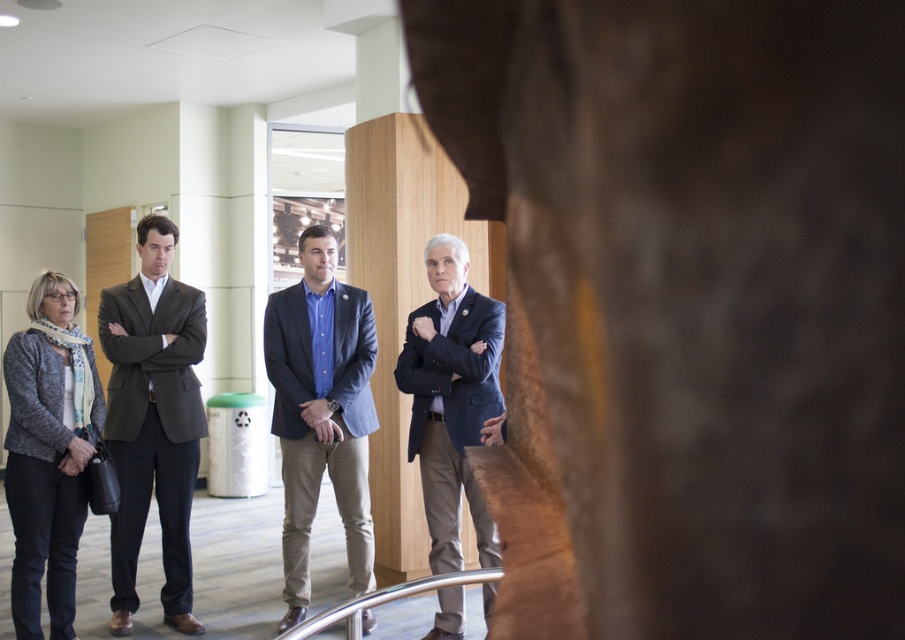
Question: Can you confirm if matte black suit at left is positioned below matte blue shirt at center?

Choices:
 (A) yes
 (B) no

Answer: (B)

Question: Does matte black suit at left have a lesser width compared to dark blue fabric business suit at center?

Choices:
 (A) no
 (B) yes

Answer: (A)

Question: Which point appears farthest from the camera in this image?

Choices:
 (A) (205, 317)
 (B) (418, 458)

Answer: (A)

Question: Among these objects, which one is nearest to the camera?

Choices:
 (A) matte blue shirt at center
 (B) dark blue fabric business suit at center

Answer: (B)

Question: Estimate the real-world distances between objects in this image. Which object is farther from the matte black suit at left?

Choices:
 (A) dark blue fabric business suit at center
 (B) matte blue shirt at center

Answer: (A)

Question: Can you confirm if matte black suit at left is positioned above matte blue shirt at center?

Choices:
 (A) no
 (B) yes

Answer: (B)